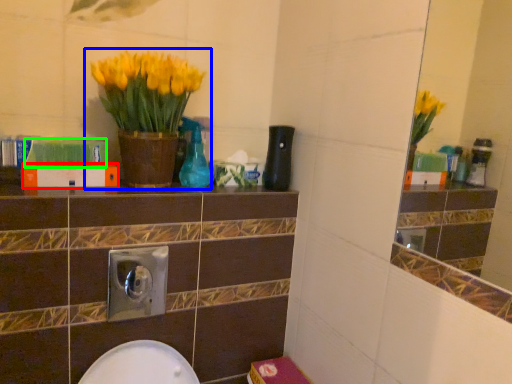
Question: Considering the real-world distances, which object is farthest from book (highlighted by a red box)? houseplant (highlighted by a blue box) or book (highlighted by a green box)?

Choices:
 (A) houseplant
 (B) book

Answer: (A)